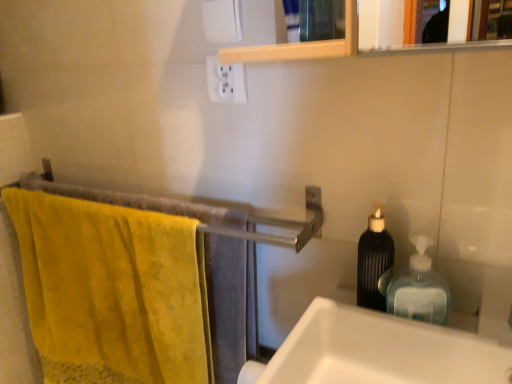
What are the coordinates of `yellow cotton towel at left` in the screenshot? It's located at pos(110,290).

Describe the element at coordinates (419, 289) in the screenshot. The width and height of the screenshot is (512, 384). I see `translucent plastic soap dispenser at right, arranged as the first bottle when viewed from the right` at that location.

Locate an element on the screen. The height and width of the screenshot is (384, 512). white plastic outlet at upper center is located at coordinates (226, 81).

Where is `white glossy sink at right`? white glossy sink at right is located at coordinates (378, 351).

Where is `yellow cotton towel at left`? The image size is (512, 384). yellow cotton towel at left is located at coordinates (110, 290).

Are white glossy sink at right and translucent plastic soap dispenser at right, placed as the 2th bottle when sorted from left to right, located far from each other?

That's not correct — white glossy sink at right is a little close to translucent plastic soap dispenser at right, placed as the 2th bottle when sorted from left to right.

Considering the sizes of white glossy sink at right and translucent plastic soap dispenser at right, placed as the 2th bottle when sorted from left to right, in the image, is white glossy sink at right bigger or smaller than translucent plastic soap dispenser at right, placed as the 2th bottle when sorted from left to right,?

Clearly, white glossy sink at right is larger in size than translucent plastic soap dispenser at right, placed as the 2th bottle when sorted from left to right.

Is white glossy sink at right at the right side of translucent plastic soap dispenser at right, placed as the 2th bottle when sorted from left to right?

No, white glossy sink at right is not to the right of translucent plastic soap dispenser at right, placed as the 2th bottle when sorted from left to right.

Is point (388, 303) positioned before point (361, 318)?

That is False.

From the image's perspective, is translucent plastic soap dispenser at right, arranged as the first bottle when viewed from the right, located above white glossy sink at right?

Yes, from the image's perspective, translucent plastic soap dispenser at right, arranged as the first bottle when viewed from the right, is on top of white glossy sink at right.

Consider the image. From a real-world perspective, is translucent plastic soap dispenser at right, placed as the 2th bottle when sorted from left to right, physically located above or below white glossy sink at right?

Clearly, from a real-world perspective, translucent plastic soap dispenser at right, placed as the 2th bottle when sorted from left to right, is above white glossy sink at right.

Find the location of `bottle on the right of white glossy sink at right`. bottle on the right of white glossy sink at right is located at coordinates (419, 289).

Is black textured bottle at right, the 2th bottle from the right, in front of or behind white plastic outlet at upper center in the image?

black textured bottle at right, the 2th bottle from the right, is in front of white plastic outlet at upper center.

Can you confirm if black textured bottle at right, the 1th bottle positioned from the left, is thinner than white plastic outlet at upper center?

In fact, black textured bottle at right, the 1th bottle positioned from the left, might be wider than white plastic outlet at upper center.

In the scene shown: From the image's perspective, is black textured bottle at right, the 1th bottle positioned from the left, located beneath white plastic outlet at upper center?

Indeed, from the image's perspective, black textured bottle at right, the 1th bottle positioned from the left, is shown beneath white plastic outlet at upper center.

Is translucent plastic soap dispenser at right, placed as the 2th bottle when sorted from left to right, not near black textured bottle at right, the 2th bottle from the right?

They are positioned close to each other.

Looking at the image, does translucent plastic soap dispenser at right, placed as the 2th bottle when sorted from left to right, seem bigger or smaller compared to black textured bottle at right, the 2th bottle from the right?

Clearly, translucent plastic soap dispenser at right, placed as the 2th bottle when sorted from left to right, is larger in size than black textured bottle at right, the 2th bottle from the right.

Is translucent plastic soap dispenser at right, placed as the 2th bottle when sorted from left to right, looking in the opposite direction of black textured bottle at right, the 1th bottle positioned from the left?

That's not correct — translucent plastic soap dispenser at right, placed as the 2th bottle when sorted from left to right, is not looking away from black textured bottle at right, the 1th bottle positioned from the left.

Consider the image. From a real-world perspective, is white matte toilet paper at upper center physically below white plastic outlet at upper center?

No, from a real-world perspective, white matte toilet paper at upper center is not beneath white plastic outlet at upper center.

Is white matte toilet paper at upper center aimed at white plastic outlet at upper center?

No, white matte toilet paper at upper center is not facing towards white plastic outlet at upper center.

Does white matte toilet paper at upper center have a greater height compared to white plastic outlet at upper center?

No.

Is white matte toilet paper at upper center thinner than white plastic outlet at upper center?

Yes, white matte toilet paper at upper center is thinner than white plastic outlet at upper center.

From a real-world perspective, between yellow cotton towel at left and black textured bottle at right, the 1th bottle positioned from the left, who is vertically higher?

black textured bottle at right, the 1th bottle positioned from the left, from a real-world perspective.

Does yellow cotton towel at left appear on the right side of black textured bottle at right, the 2th bottle from the right?

No, yellow cotton towel at left is not to the right of black textured bottle at right, the 2th bottle from the right.

How distant is yellow cotton towel at left from black textured bottle at right, the 2th bottle from the right?

yellow cotton towel at left is 21.99 inches from black textured bottle at right, the 2th bottle from the right.

Considering the sizes of objects yellow cotton towel at left and black textured bottle at right, the 2th bottle from the right, in the image provided, who is smaller, yellow cotton towel at left or black textured bottle at right, the 2th bottle from the right,?

black textured bottle at right, the 2th bottle from the right, is smaller.

From a real-world perspective, which is physically above, white plastic outlet at upper center or black textured bottle at right, the 1th bottle positioned from the left?

white plastic outlet at upper center is physically above.

Is white plastic outlet at upper center situated inside black textured bottle at right, the 1th bottle positioned from the left, or outside?

white plastic outlet at upper center cannot be found inside black textured bottle at right, the 1th bottle positioned from the left.

Does white plastic outlet at upper center turn towards black textured bottle at right, the 2th bottle from the right?

No, white plastic outlet at upper center is not facing towards black textured bottle at right, the 2th bottle from the right.

Identify the location of the 1st bottle positioned above the white glossy sink at right (from the image's perspective). The image size is (512, 384). (419, 289).

Where is `bottle that is the 1st one when counting backward from the white glossy sink at right`? This screenshot has width=512, height=384. bottle that is the 1st one when counting backward from the white glossy sink at right is located at coordinates click(419, 289).

Estimate the real-world distances between objects in this image. Which object is closer to white glossy sink at right, white matte toilet paper at upper center or yellow cotton towel at left?

yellow cotton towel at left is positioned closer to the anchor white glossy sink at right.

Consider the image. Which object lies nearer to the anchor point white glossy sink at right, white plastic outlet at upper center or translucent plastic soap dispenser at right, placed as the 2th bottle when sorted from left to right?

translucent plastic soap dispenser at right, placed as the 2th bottle when sorted from left to right.

Estimate the real-world distances between objects in this image. Which object is further from white plastic outlet at upper center, white matte toilet paper at upper center or translucent plastic soap dispenser at right, placed as the 2th bottle when sorted from left to right?

The object further to white plastic outlet at upper center is translucent plastic soap dispenser at right, placed as the 2th bottle when sorted from left to right.

Looking at the image, which one is located further to white plastic outlet at upper center, translucent plastic soap dispenser at right, placed as the 2th bottle when sorted from left to right, or black textured bottle at right, the 1th bottle positioned from the left?

translucent plastic soap dispenser at right, placed as the 2th bottle when sorted from left to right, lies further to white plastic outlet at upper center than the other object.

Based on their spatial positions, is white glossy sink at right or white matte toilet paper at upper center closer to yellow cotton towel at left?

white glossy sink at right is closer to yellow cotton towel at left.

Estimate the real-world distances between objects in this image. Which object is further from yellow cotton towel at left, black textured bottle at right, the 1th bottle positioned from the left, or white matte toilet paper at upper center?

Based on the image, white matte toilet paper at upper center appears to be further to yellow cotton towel at left.

Based on their spatial positions, is translucent plastic soap dispenser at right, arranged as the first bottle when viewed from the right, or black textured bottle at right, the 1th bottle positioned from the left, further from white glossy sink at right?

black textured bottle at right, the 1th bottle positioned from the left, lies further to white glossy sink at right than the other object.

Which object lies nearer to the anchor point translucent plastic soap dispenser at right, placed as the 2th bottle when sorted from left to right, white glossy sink at right or white plastic outlet at upper center?

Among the two, white glossy sink at right is located nearer to translucent plastic soap dispenser at right, placed as the 2th bottle when sorted from left to right.

Where is `sink between white plastic outlet at upper center and yellow cotton towel at left vertically`? sink between white plastic outlet at upper center and yellow cotton towel at left vertically is located at coordinates (378, 351).

Find the location of a particular element. The height and width of the screenshot is (384, 512). bottle between white plastic outlet at upper center and translucent plastic soap dispenser at right, arranged as the first bottle when viewed from the right, from top to bottom is located at coordinates (374, 262).

Locate an element on the screen. Image resolution: width=512 pixels, height=384 pixels. bottle situated between yellow cotton towel at left and white glossy sink at right from left to right is located at coordinates (374, 262).

Where is `electric outlet between white matte toilet paper at upper center and translucent plastic soap dispenser at right, arranged as the first bottle when viewed from the right, vertically`? This screenshot has width=512, height=384. electric outlet between white matte toilet paper at upper center and translucent plastic soap dispenser at right, arranged as the first bottle when viewed from the right, vertically is located at coordinates (226, 81).